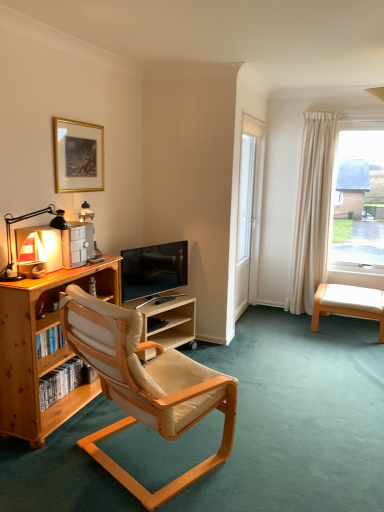
Question: Can you confirm if matte black desk lamp at left is smaller than beige leather swivel chair at lower right?

Choices:
 (A) no
 (B) yes

Answer: (B)

Question: Is matte black desk lamp at left taller than beige leather swivel chair at lower right?

Choices:
 (A) yes
 (B) no

Answer: (A)

Question: From a real-world perspective, is matte black desk lamp at left physically above beige leather swivel chair at lower right?

Choices:
 (A) no
 (B) yes

Answer: (B)

Question: Is matte black desk lamp at left aimed at beige leather swivel chair at lower right?

Choices:
 (A) no
 (B) yes

Answer: (A)

Question: From the image's perspective, is matte black desk lamp at left on top of beige leather swivel chair at lower right?

Choices:
 (A) yes
 (B) no

Answer: (A)

Question: From a real-world perspective, is beige leather swivel chair at lower right physically located above or below matte black desk lamp at left?

Choices:
 (A) below
 (B) above

Answer: (A)

Question: Which is correct: beige leather swivel chair at lower right is inside matte black desk lamp at left, or outside of it?

Choices:
 (A) inside
 (B) outside

Answer: (B)

Question: Relative to matte black desk lamp at left, is beige leather swivel chair at lower right in front or behind?

Choices:
 (A) behind
 (B) front

Answer: (A)

Question: Based on their sizes in the image, would you say beige leather swivel chair at lower right is bigger or smaller than matte black desk lamp at left?

Choices:
 (A) small
 (B) big

Answer: (B)

Question: From their relative heights in the image, would you say light wood/woodenobject at center is taller or shorter than matte black desk lamp at left?

Choices:
 (A) tall
 (B) short

Answer: (A)

Question: Visually, is light wood/woodenobject at center positioned to the left or to the right of matte black desk lamp at left?

Choices:
 (A) left
 (B) right

Answer: (B)

Question: Is light wood/woodenobject at center wider or thinner than matte black desk lamp at left?

Choices:
 (A) thin
 (B) wide

Answer: (B)

Question: From the image's perspective, relative to matte black desk lamp at left, is light wood/woodenobject at center above or below?

Choices:
 (A) below
 (B) above

Answer: (A)

Question: Relative to white glass screen door at center, is wooden bookcase at left in front or behind?

Choices:
 (A) behind
 (B) front

Answer: (B)

Question: From the image's perspective, is wooden bookcase at left located above or below white glass screen door at center?

Choices:
 (A) below
 (B) above

Answer: (A)